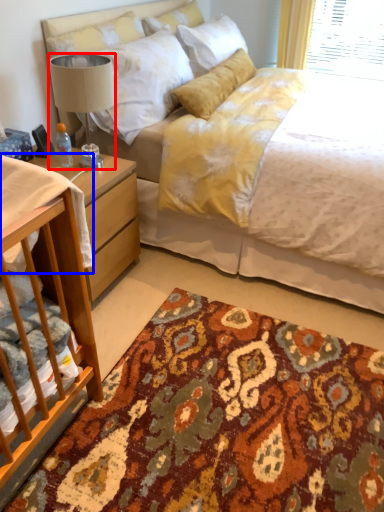
Question: Which point is further to the camera, lamp (highlighted by a red box) or sheet (highlighted by a blue box)?

Choices:
 (A) lamp
 (B) sheet

Answer: (A)